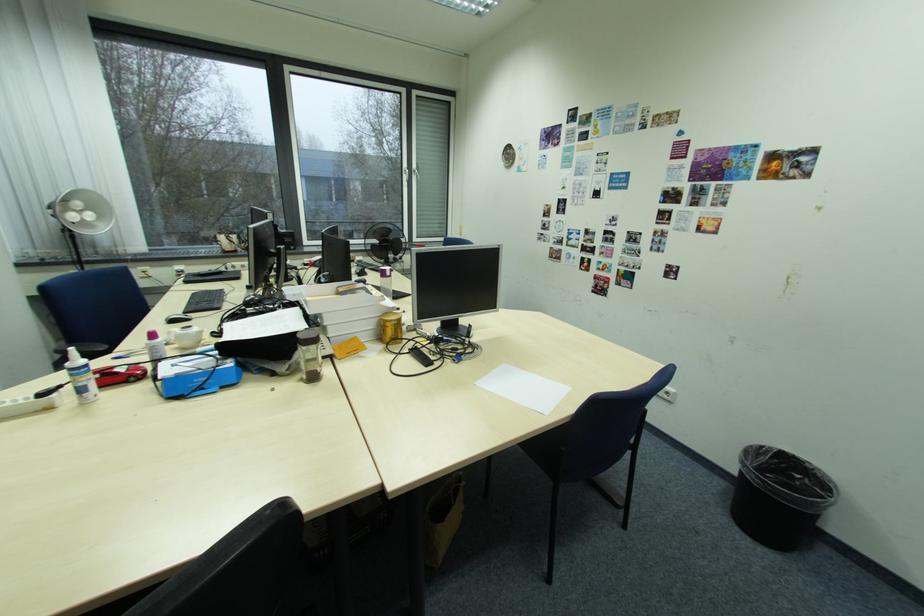
What do you see at coordinates (406, 175) in the screenshot? I see `the white window handle` at bounding box center [406, 175].